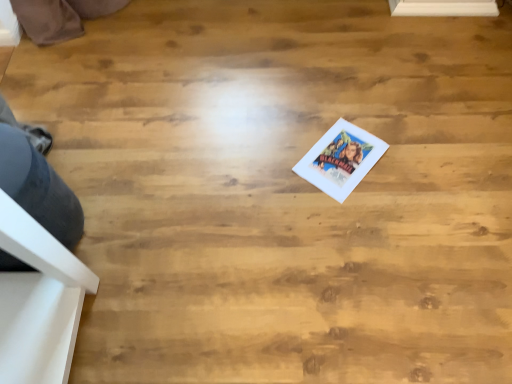
Locate an element on the screen. vacant space behind matte paper postcard at center is located at coordinates (329, 108).